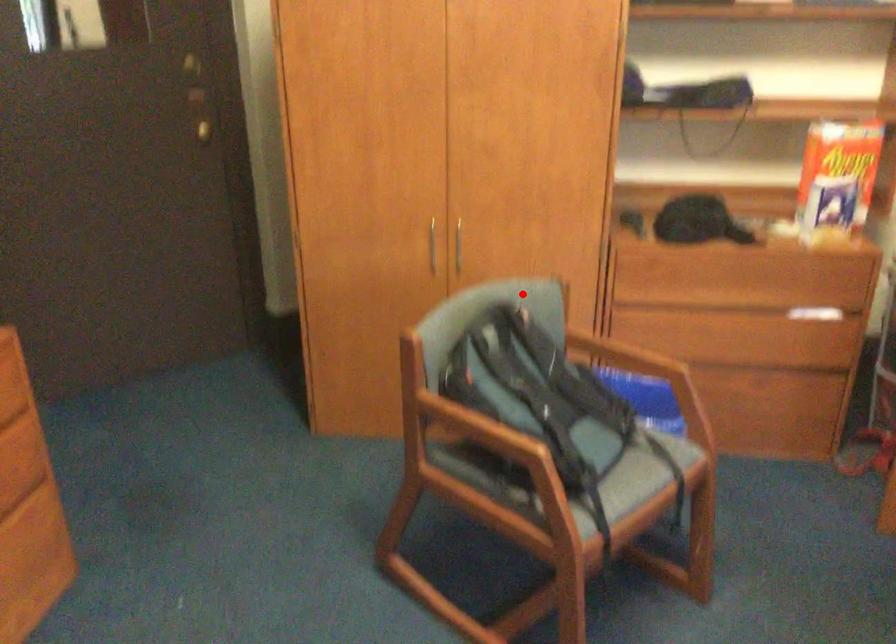
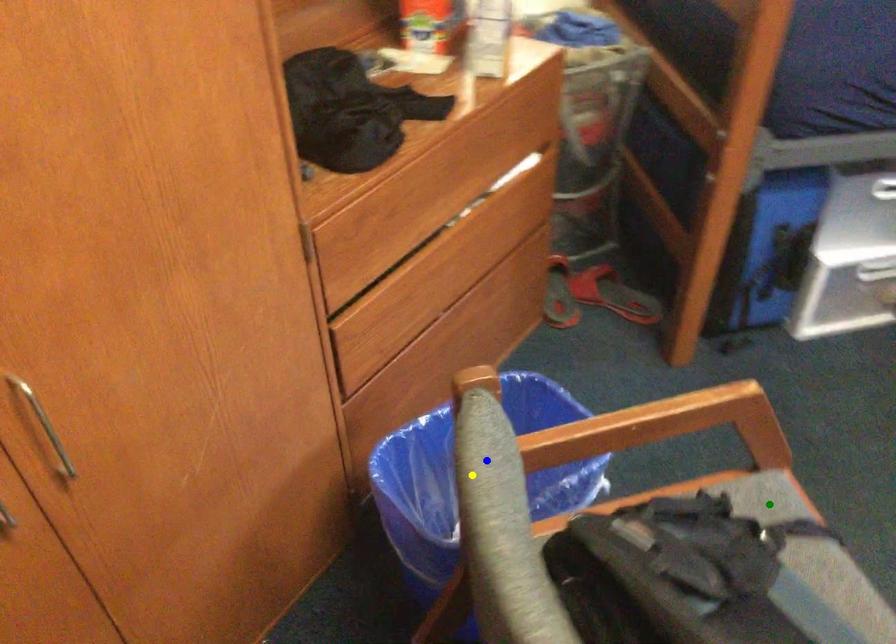
Question: I am providing you with two images of the same scene from different viewpoints. A red point is marked on the first image. You are given multiple points on the second image. Which point in image 2 is actually the same real-world point as the red point in image 1?

Choices:
 (A) blue point
 (B) green point
 (C) yellow point

Answer: (A)